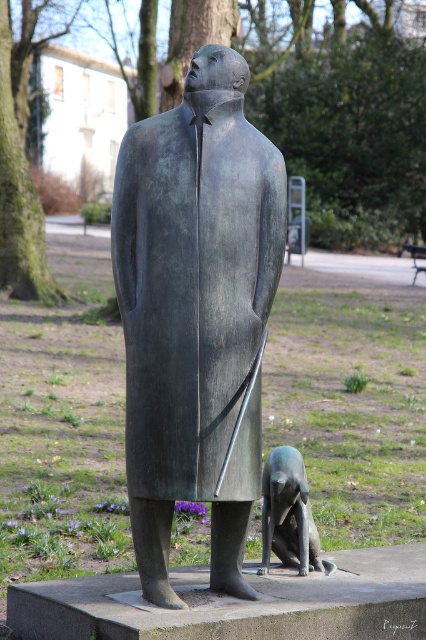
Question: From the image, what is the correct spatial relationship of bronze dog at lower center in relation to wooden park bench at center?

Choices:
 (A) above
 (B) below

Answer: (B)

Question: Which of the following is the closest to the observer?

Choices:
 (A) bronze statue at center
 (B) bronze dog at lower center
 (C) wooden park bench at center

Answer: (A)

Question: Is bronze statue at center below bronze dog at lower center?

Choices:
 (A) no
 (B) yes

Answer: (A)

Question: Among these objects, which one is nearest to the camera?

Choices:
 (A) bronze statue at center
 (B) bronze dog at lower center
 (C) wooden park bench at center

Answer: (A)

Question: Which of the following is the closest to the observer?

Choices:
 (A) wooden park bench at center
 (B) bronze statue at center

Answer: (B)

Question: Is bronze statue at center to the right of bronze dog at lower center from the viewer's perspective?

Choices:
 (A) yes
 (B) no

Answer: (B)